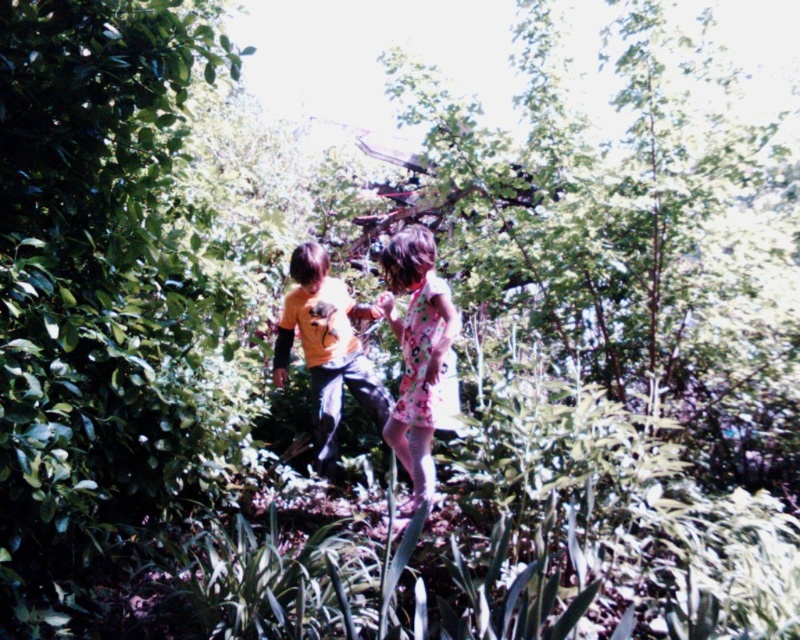
You are a photographer trying to capture a clear shot of the children in the garden. You notice the floral dress at center and the orange matte shirt at center. Which clothing item appears narrower in the photo?

The floral dress at center is thinner than the orange matte shirt at center, so it appears narrower in the photo.

You are a photographer standing at the center of the garden. You want to take a photo that includes both the point at (448,362) and the point at (336,337). Which point should you focus on first to ensure both are in the frame?

You should focus on point (448,362) first because it is closer to you than point (336,337), ensuring both points remain within the frame.